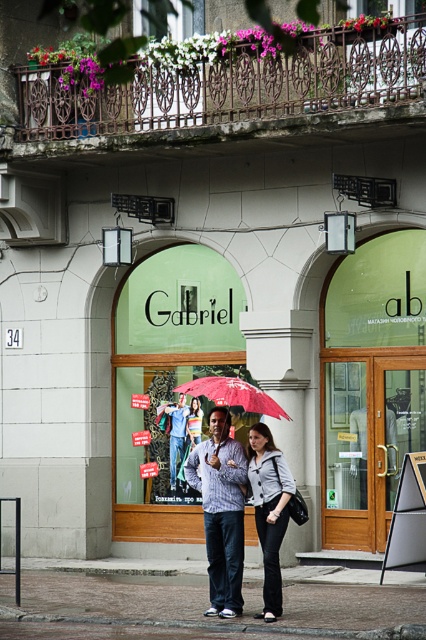
Is point (244, 490) closer to viewer compared to point (282, 528)?

No, (244, 490) is behind (282, 528).

Describe the element at coordinates (221, 509) in the screenshot. Image resolution: width=426 pixels, height=640 pixels. I see `matte blue jeans at center` at that location.

Does point (184, 468) lie behind point (278, 609)?

Yes.

Find the location of a particular element. This screenshot has width=426, height=640. matte blue jeans at center is located at coordinates (221, 509).

Based on the photo, which of these two, brown brick pavement at center or red matte umbrella at center, stands taller?

Standing taller between the two is red matte umbrella at center.

Can you confirm if brown brick pavement at center is wider than red matte umbrella at center?

No.

Which is behind, point (363, 611) or point (241, 380)?

The point (241, 380) is more distant.

The height and width of the screenshot is (640, 426). I want to click on brown brick pavement at center, so click(x=207, y=602).

Looking at this image, does brown brick pavement at center have a greater width compared to matte blue jeans at center?

Yes.

The width and height of the screenshot is (426, 640). What do you see at coordinates (207, 602) in the screenshot?
I see `brown brick pavement at center` at bounding box center [207, 602].

This screenshot has width=426, height=640. What do you see at coordinates (207, 602) in the screenshot?
I see `brown brick pavement at center` at bounding box center [207, 602].

The image size is (426, 640). Identify the location of brown brick pavement at center. (207, 602).